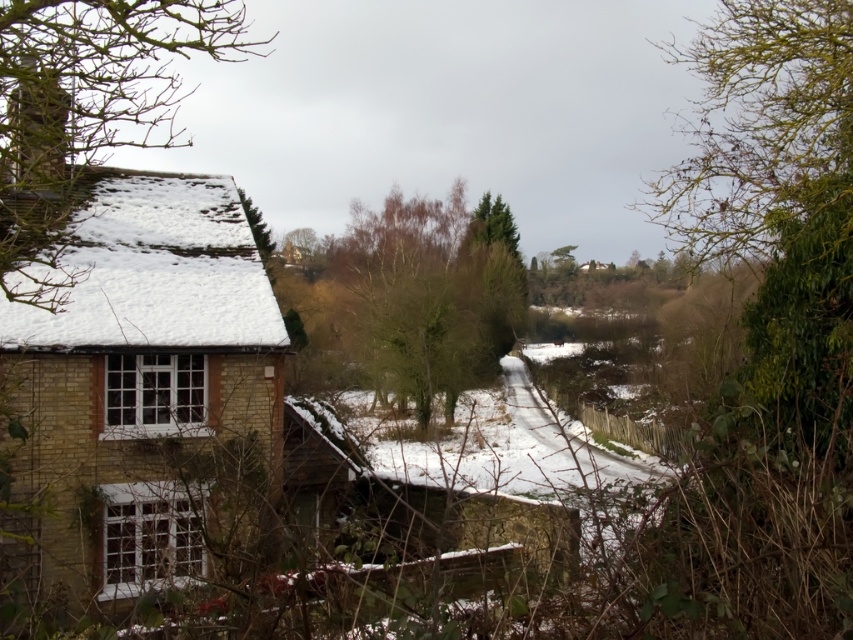
Which of these two, white fluffy roof at left or brown textured tree at center, stands taller?

brown textured tree at center is taller.

Which is above, white fluffy roof at left or brown textured tree at center?

Positioned higher is brown textured tree at center.

Locate an element on the screen. white fluffy roof at left is located at coordinates (155, 273).

The width and height of the screenshot is (853, 640). I want to click on white fluffy roof at left, so click(155, 273).

Does bare branches at left have a greater width compared to brown textured tree at center?

Yes.

The image size is (853, 640). What do you see at coordinates (126, 310) in the screenshot?
I see `bare branches at left` at bounding box center [126, 310].

Identify the location of bare branches at left. The image size is (853, 640). (126, 310).

Where is `bare branches at left`? This screenshot has width=853, height=640. bare branches at left is located at coordinates (126, 310).

Does point (53, 596) come behind point (126, 225)?

No, it is not.

The height and width of the screenshot is (640, 853). I want to click on bare branches at left, so click(126, 310).